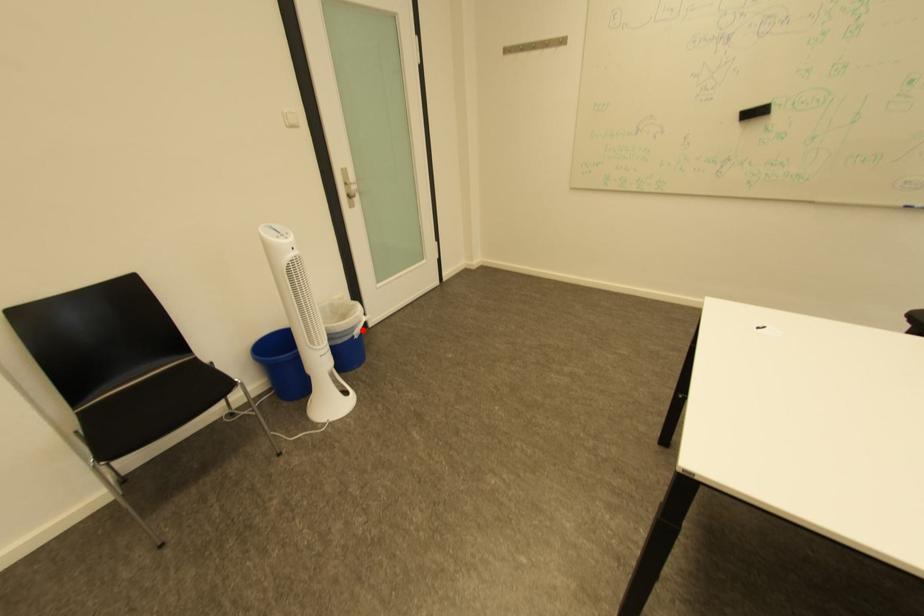
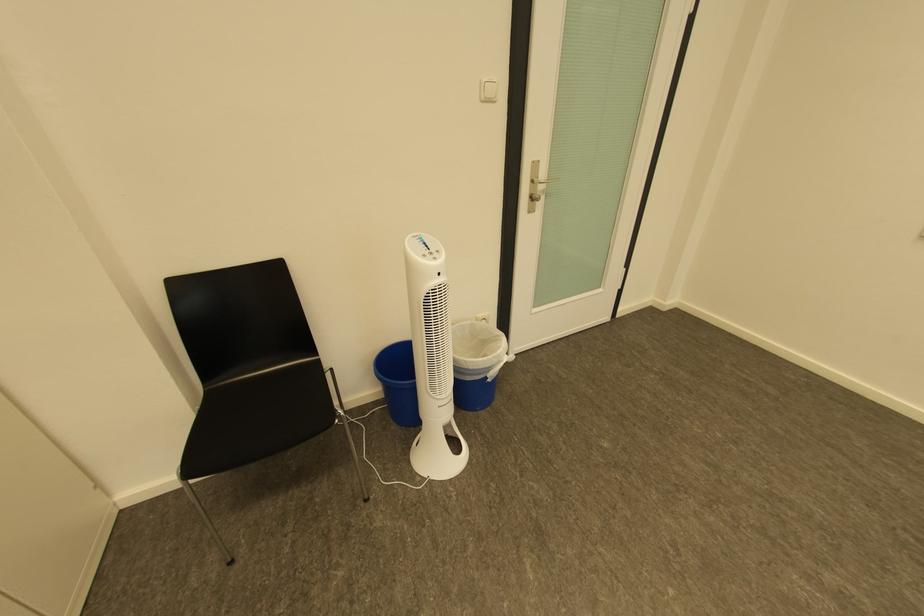
Question: A red point is marked in image1. In image2, is the corresponding 3D point closer to the camera or farther? Reply with the corresponding letter.

Choices:
 (A) The corresponding 3D point is closer.
 (B) The corresponding 3D point is farther.

Answer: (B)